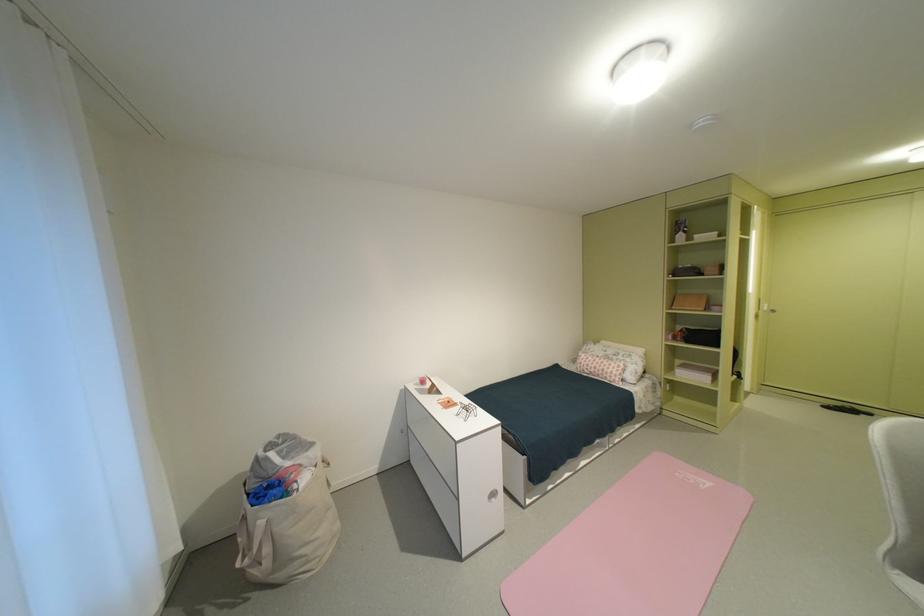
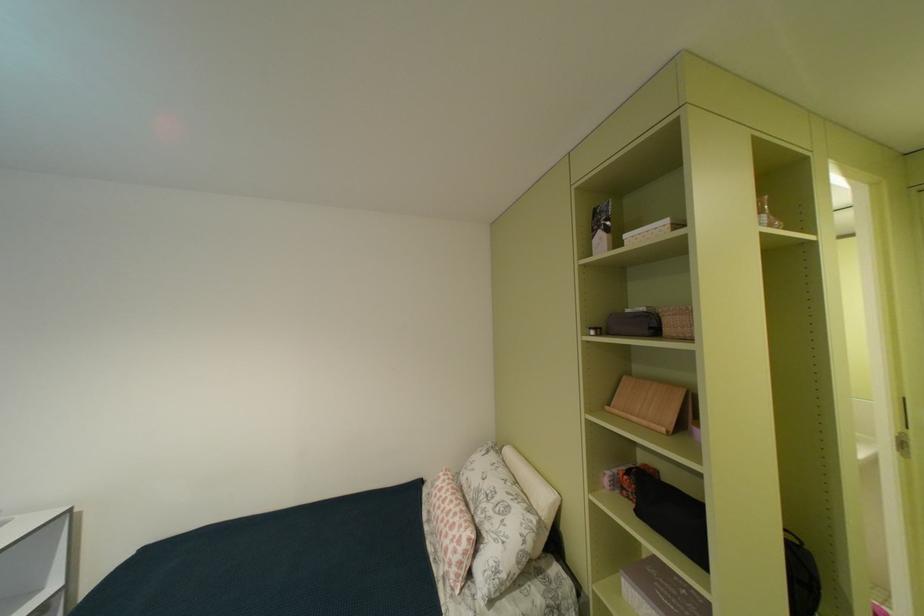
What movement of the cameraman would produce the second image?

The cameraman moved toward right, forward.